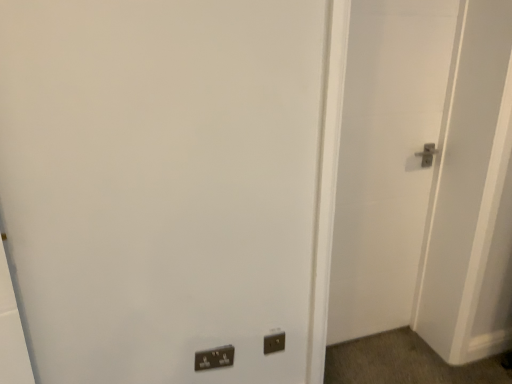
Question: From a real-world perspective, is black plastic electric outlet at lower center under white matte door at right?

Choices:
 (A) yes
 (B) no

Answer: (A)

Question: Does black plastic electric outlet at lower center have a lesser height compared to white matte door at right?

Choices:
 (A) yes
 (B) no

Answer: (A)

Question: Could you tell me if black plastic electric outlet at lower center is facing white matte door at right?

Choices:
 (A) no
 (B) yes

Answer: (A)

Question: Is black plastic electric outlet at lower center taller than white matte door at right?

Choices:
 (A) yes
 (B) no

Answer: (B)

Question: Does black plastic electric outlet at lower center have a smaller size compared to white matte door at right?

Choices:
 (A) no
 (B) yes

Answer: (B)

Question: Is black plastic electric outlet at lower center wider than white matte door at right?

Choices:
 (A) yes
 (B) no

Answer: (B)

Question: From the image's perspective, does black plastic electric outlet at lower center appear lower than matte black switch at lower center?

Choices:
 (A) yes
 (B) no

Answer: (B)

Question: Is black plastic electric outlet at lower center taller than matte black switch at lower center?

Choices:
 (A) yes
 (B) no

Answer: (B)

Question: From a real-world perspective, is black plastic electric outlet at lower center physically below matte black switch at lower center?

Choices:
 (A) yes
 (B) no

Answer: (B)

Question: Is black plastic electric outlet at lower center not near matte black switch at lower center?

Choices:
 (A) yes
 (B) no

Answer: (B)

Question: Is black plastic electric outlet at lower center oriented towards matte black switch at lower center?

Choices:
 (A) yes
 (B) no

Answer: (B)

Question: Considering the relative sizes of black plastic electric outlet at lower center and matte black switch at lower center in the image provided, is black plastic electric outlet at lower center bigger than matte black switch at lower center?

Choices:
 (A) no
 (B) yes

Answer: (A)

Question: Are white matte door at right and black plastic electric outlet at lower center far apart?

Choices:
 (A) no
 (B) yes

Answer: (A)